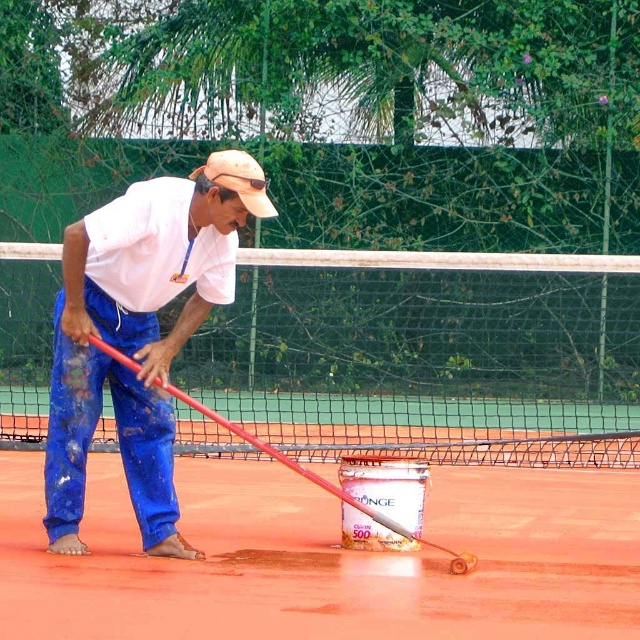
Question: In this image, where is smooth clay surface at center located relative to blue cotton pants at center?

Choices:
 (A) right
 (B) left

Answer: (A)

Question: Which of these objects is positioned farthest from the smooth clay surface at center?

Choices:
 (A) tan fabric baseball cap at center
 (B) blue cotton pants at center

Answer: (A)

Question: Which of the following is the closest to the observer?

Choices:
 (A) (253, 184)
 (B) (428, 292)
 (C) (60, 378)

Answer: (A)

Question: Can you confirm if blue cotton pants at center is positioned above tan fabric baseball cap at center?

Choices:
 (A) yes
 (B) no

Answer: (B)

Question: Is white mesh tennis net at center below tan fabric baseball cap at center?

Choices:
 (A) yes
 (B) no

Answer: (A)

Question: Which point is closer to the camera taking this photo?

Choices:
 (A) (4, 496)
 (B) (132, 324)

Answer: (B)